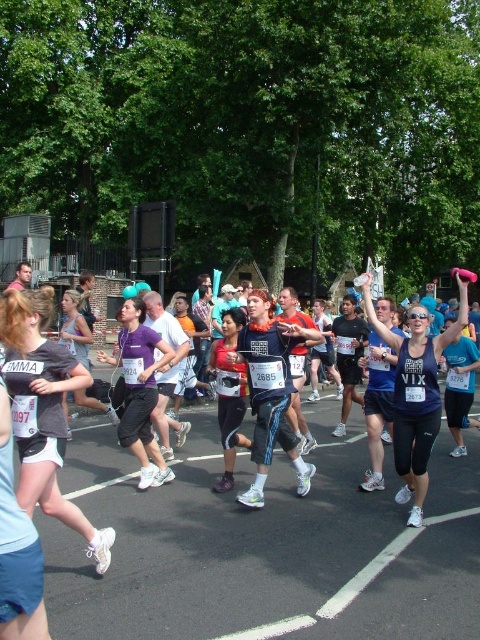
Question: Is matte gray tank top at center further to the viewer compared to purple fabric shirt at center?

Choices:
 (A) no
 (B) yes

Answer: (A)

Question: Which object appears farthest from the camera in this image?

Choices:
 (A) purple fabric shirt at center
 (B) purple matte tank top at center

Answer: (A)

Question: Is matte red tank top at center thinner than purple fabric shirt at center?

Choices:
 (A) no
 (B) yes

Answer: (A)

Question: Is purple matte tank top at center smaller than matte red tank top at center?

Choices:
 (A) no
 (B) yes

Answer: (A)

Question: Which point is closer to the camera?

Choices:
 (A) (146, 449)
 (B) (232, 385)

Answer: (A)

Question: Which point appears farthest from the camera in this image?

Choices:
 (A) (72, 524)
 (B) (415, 452)
 (C) (230, 337)
 (D) (134, 300)

Answer: (C)